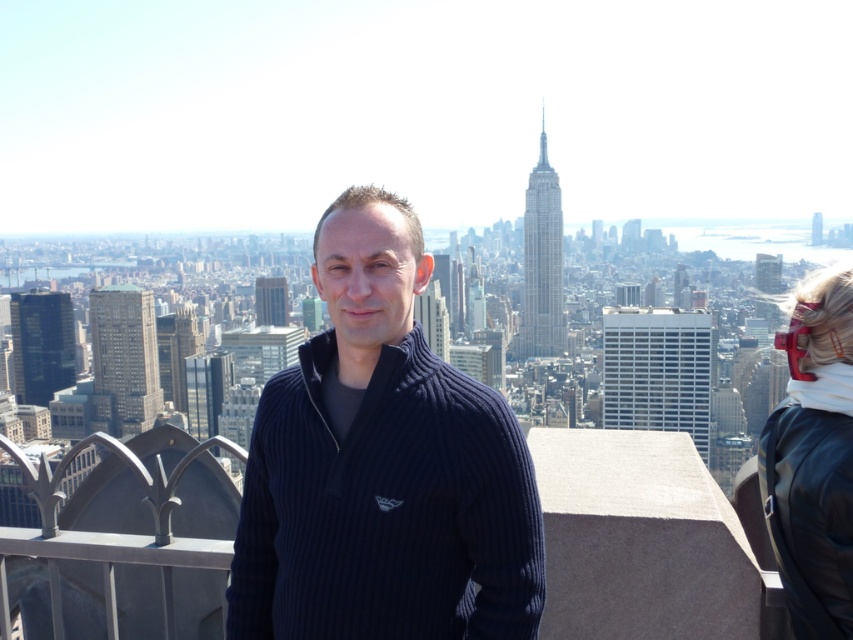
Does dark blue ribbed sweater at center have a larger size compared to white fleece at right?

Yes, dark blue ribbed sweater at center is bigger than white fleece at right.

Between point (476, 451) and point (790, 609), which one is positioned in front?

Point (790, 609) is in front.

I want to click on dark blue ribbed sweater at center, so click(x=381, y=467).